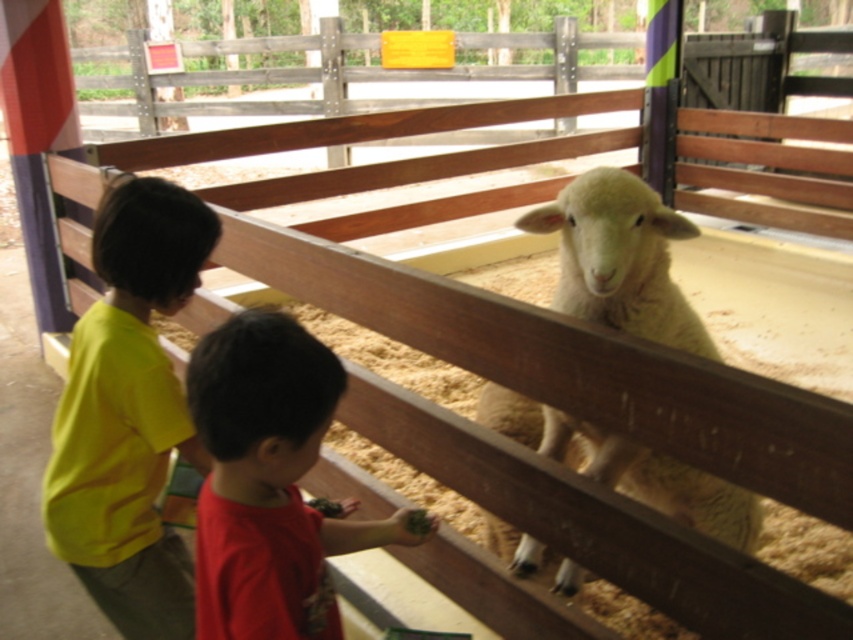
You are a photographer trying to capture a clear shot of the yellow matte shirt at left and the white woolen sheep at center. Given their sizes in the frame, which one might you need to zoom in closer to ensure it fills the photo adequately?

The yellow matte shirt at left occupies less space than the white woolen sheep at center, so you would need to zoom in closer on the yellow matte shirt at left to ensure it fills the photo adequately.